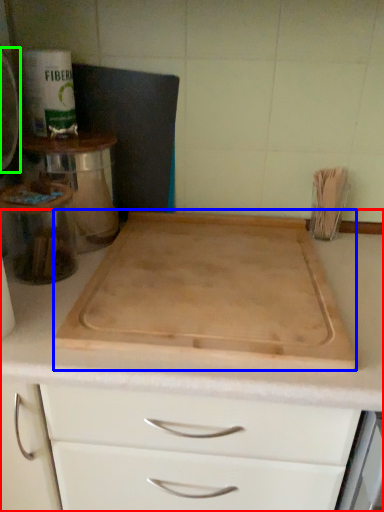
Question: Which object is the farthest from countertop (highlighted by a red box)? Choose among these: cutting board (highlighted by a blue box) or appliance (highlighted by a green box).

Choices:
 (A) cutting board
 (B) appliance

Answer: (B)